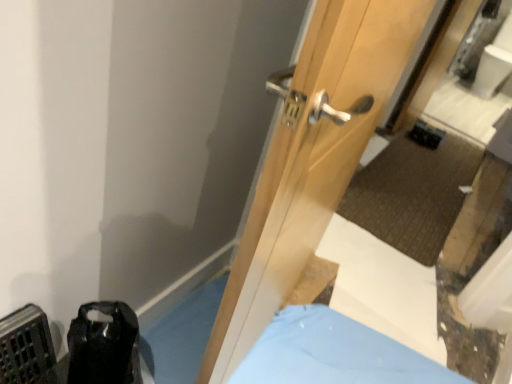
Describe the element at coordinates (311, 160) in the screenshot. I see `natural wood door at center` at that location.

Identify the location of natural wood door at center. (311, 160).

Where is `natural wood door at center`? This screenshot has height=384, width=512. natural wood door at center is located at coordinates (311, 160).